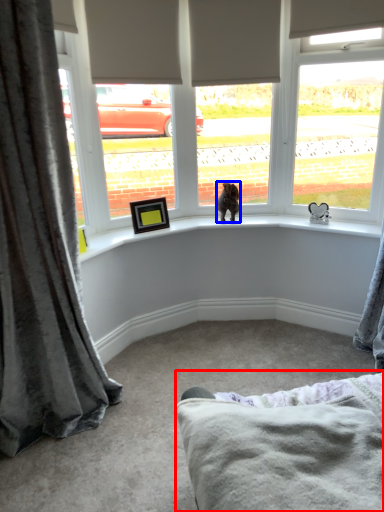
Question: Which point is further to the camera, bedding (highlighted by a red box) or animal (highlighted by a blue box)?

Choices:
 (A) bedding
 (B) animal

Answer: (B)